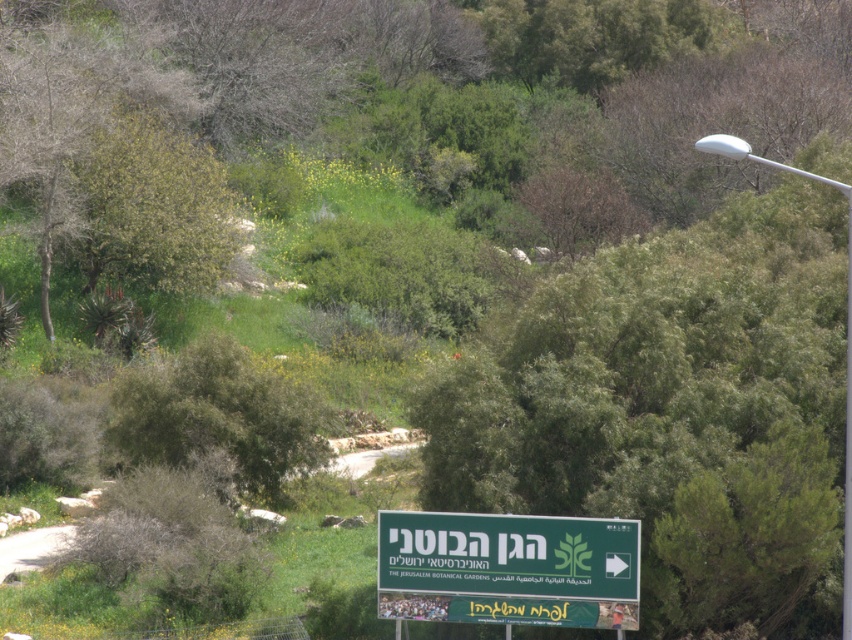
Question: In this image, where is green leafy tree at center located relative to green plastic sign at lower center?

Choices:
 (A) left
 (B) right

Answer: (B)

Question: Which of the following is the closest to the observer?

Choices:
 (A) green plastic sign at lower center
 (B) green leafy tree at center

Answer: (A)

Question: Is green leafy tree at center closer to camera compared to green plastic sign at lower center?

Choices:
 (A) no
 (B) yes

Answer: (A)

Question: Does green leafy tree at center have a smaller size compared to green plastic sign at lower center?

Choices:
 (A) no
 (B) yes

Answer: (A)

Question: Among these points, which one is farthest from the camera?

Choices:
 (A) (833, 417)
 (B) (413, 586)

Answer: (A)

Question: Which of the following is the closest to the observer?

Choices:
 (A) (482, 516)
 (B) (663, 513)

Answer: (A)